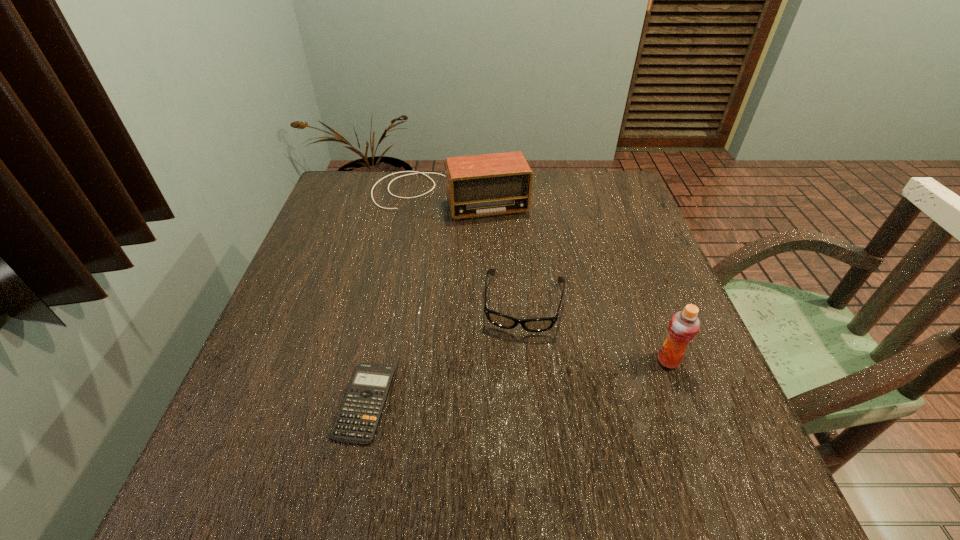
Identify the location of free space on the desktop that is between the calculator and the orange juice and is positioned on the front-facing side of the radio receiver. The image size is (960, 540). (493, 384).

The height and width of the screenshot is (540, 960). Identify the location of vacant space on the desktop that is between the calculator and the rightmost object and is positioned on the front-facing side of the third nearest object. (514, 382).